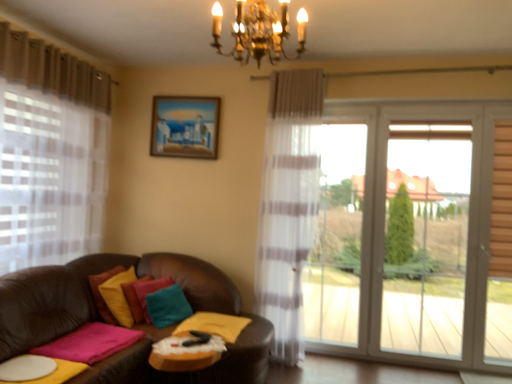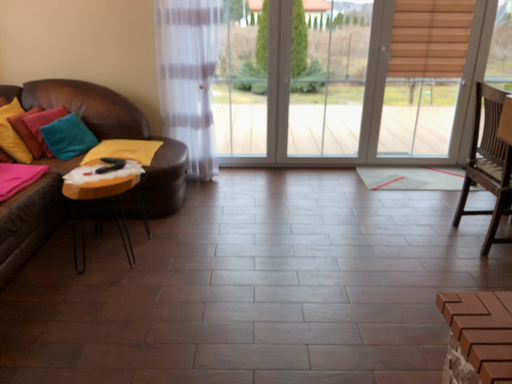
Question: How did the camera likely rotate when shooting the video?

Choices:
 (A) rotated right
 (B) rotated left

Answer: (A)